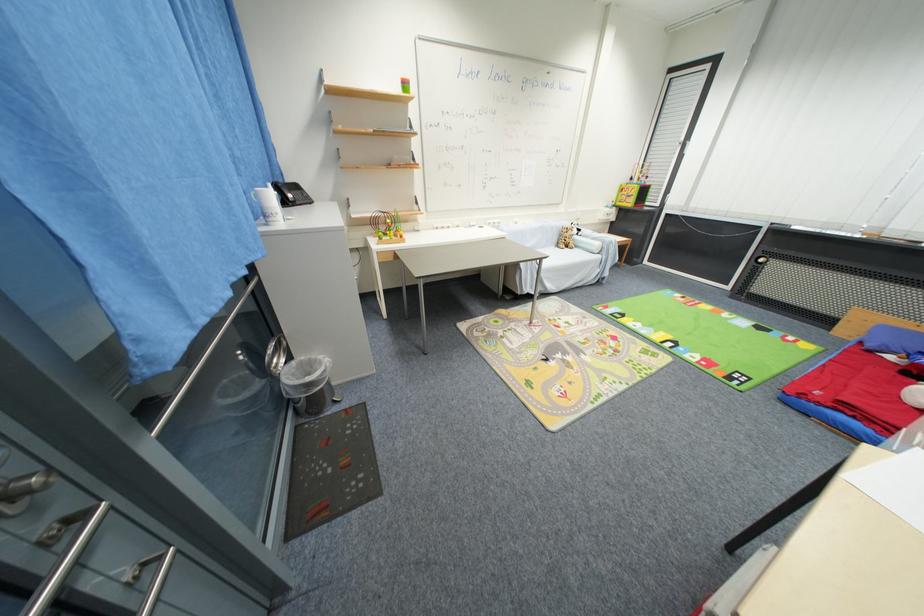
What do you see at coordinates (592, 259) in the screenshot? I see `a sofa armrest` at bounding box center [592, 259].